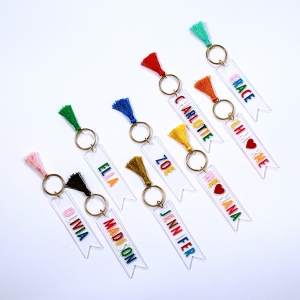
The image size is (300, 300). What are the coordinates of `black tassel` in the screenshot? It's located at (81, 183).